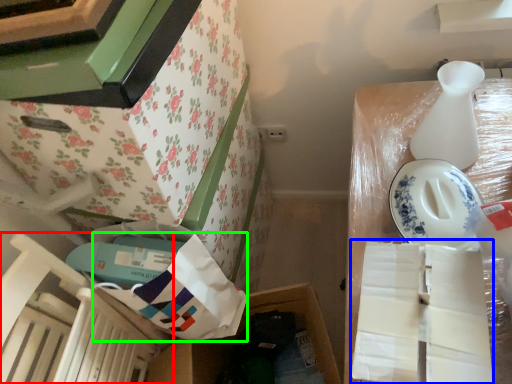
Question: Estimate the real-world distances between objects in this image. Which object is closer to chair (highlighted by a red box), wrapping paper (highlighted by a blue box) or wrapping paper (highlighted by a green box)?

Choices:
 (A) wrapping paper
 (B) wrapping paper

Answer: (B)